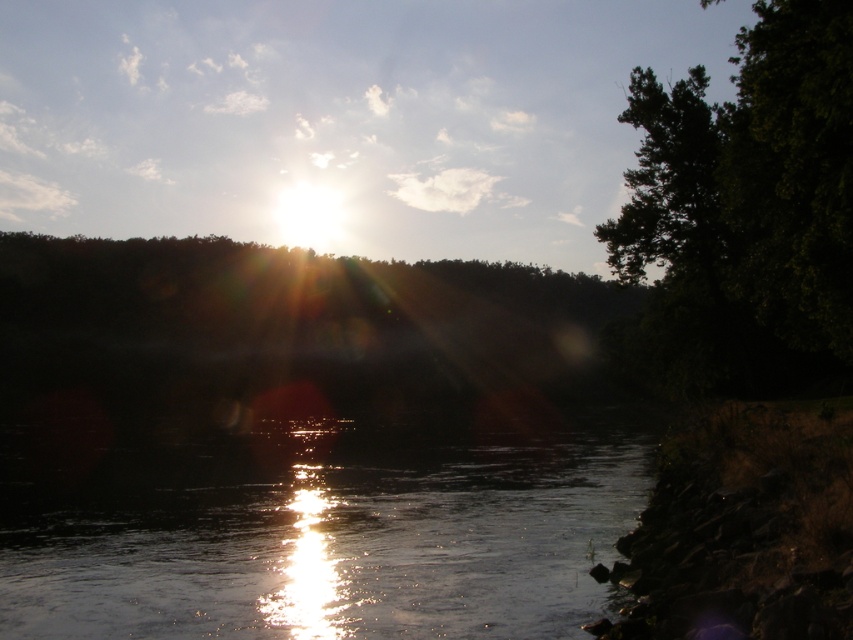
You are an artist setting up your easel to paint the riverside scene. You want to ensure that the green leafy tree at right is taller than the glistening water at center in your painting. Based on the scene description, will the tree naturally appear taller than the water in the actual view?

Yes, the green leafy tree at right is taller than the glistening water at center in the actual view, so it will naturally appear taller in the painting.

You are an observer standing at the riverside. You notice the glistening water at center and the green leafy tree at right. Which object is closer to the horizon?

The glistening water at center is positioned under the green leafy tree at right, meaning it is closer to the horizon than the tree.